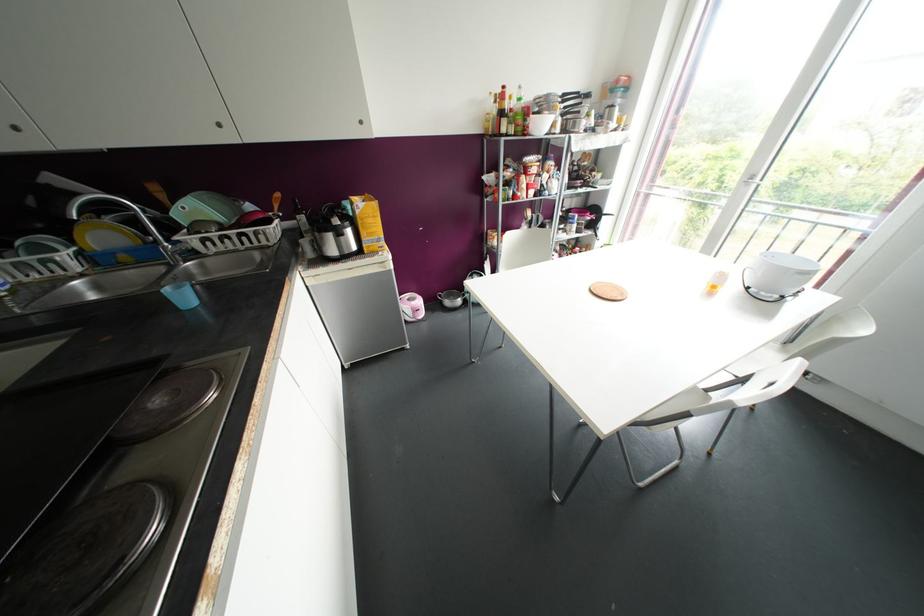
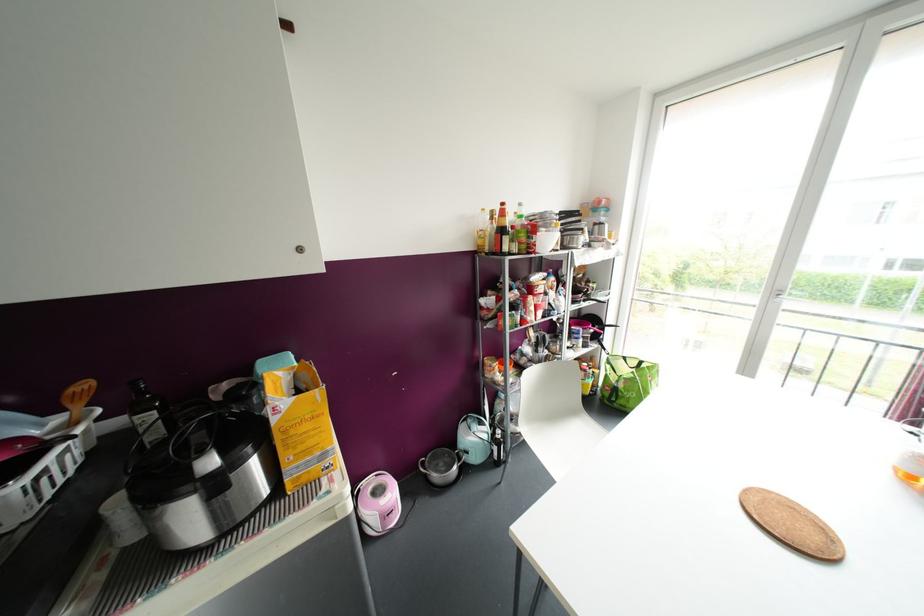
In the second image, find the point that corresponds to [503,86] in the first image.

(502, 204)